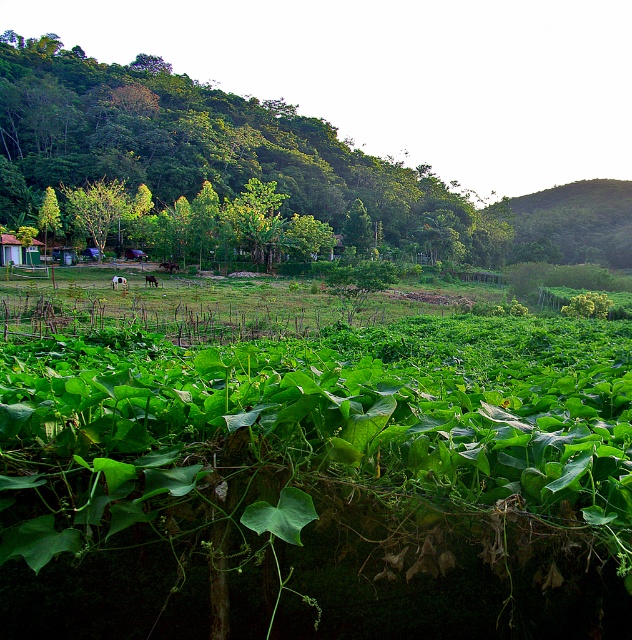
You are standing in the rural landscape scene. There is a green leafy tree at center. Can you confirm if the point marked at coordinates (210, 150) corresponds to the location of the green leafy tree at center?

Yes, the green leafy tree at center is represented by point (210, 150).